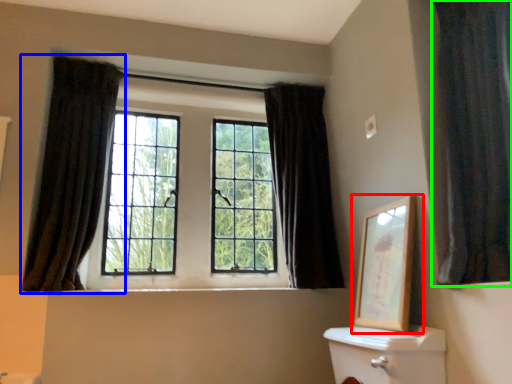
Question: Which is nearer to the picture frame (highlighted by a red box)? curtain (highlighted by a blue box) or curtain (highlighted by a green box).

Choices:
 (A) curtain
 (B) curtain

Answer: (B)